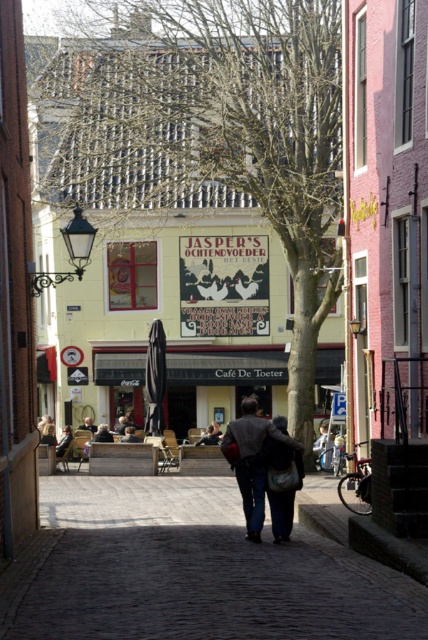
This screenshot has width=428, height=640. What do you see at coordinates (220, 132) in the screenshot?
I see `green leafy tree at center` at bounding box center [220, 132].

Is point (121, 156) positioned behind point (83, 422)?

Yes, it is.

Is point (128, 196) behind point (94, 428)?

Yes, it is behind point (94, 428).

At what (x,y) coordinates should I click in order to perform the action: click on green leafy tree at center. Please return your answer as a coordinate pair (x, y). This screenshot has width=428, height=640. Looking at the image, I should click on (220, 132).

Which of these two, green leafy tree at center or dark gray fabric coat at center, stands shorter?

dark gray fabric coat at center

Is point (323, 179) more distant than point (261, 513)?

Yes, it is.

At what (x,y) coordinates should I click in order to perform the action: click on green leafy tree at center. Please return your answer as a coordinate pair (x, y). The image size is (428, 640). Looking at the image, I should click on click(x=220, y=132).

Is dark gray fabric coat at center positioned before dark gray suit at center?

Yes, dark gray fabric coat at center is in front of dark gray suit at center.

Between point (281, 417) and point (85, 417), which one is positioned in front?

Point (281, 417) is more forward.

Locate an element on the screen. The image size is (428, 640). dark gray fabric coat at center is located at coordinates (256, 460).